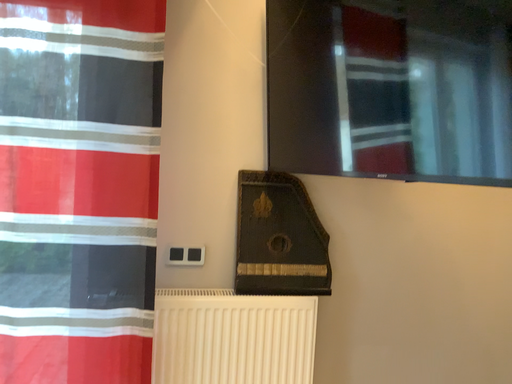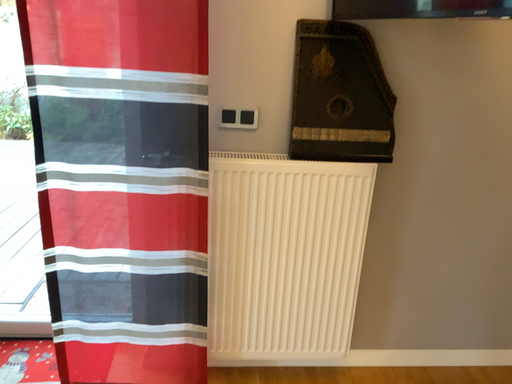
Question: How did the camera likely rotate when shooting the video?

Choices:
 (A) rotated upward
 (B) rotated downward

Answer: (B)